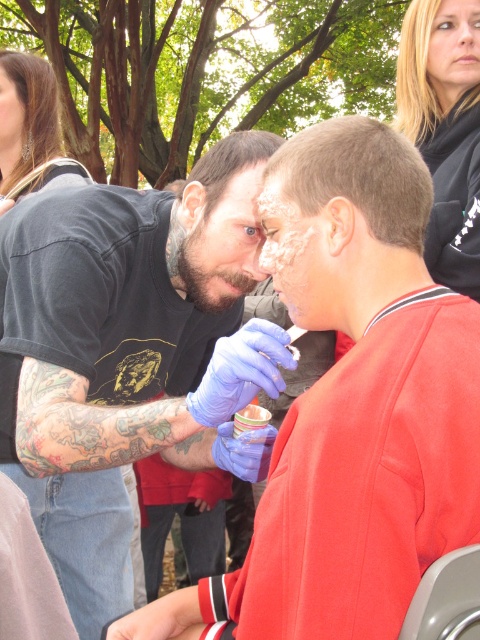
Question: Estimate the real-world distances between objects in this image. Which object is farther from the bearded man at center?

Choices:
 (A) blonde hair at upper right
 (B) white matte face paint at center

Answer: (A)

Question: Is blue latex gloves at center below white matte face paint at center?

Choices:
 (A) yes
 (B) no

Answer: (A)

Question: Which point is closer to the camera?

Choices:
 (A) pos(444,65)
 (B) pos(420,513)
 (C) pos(249,188)

Answer: (B)

Question: Is bearded man at center to the left of smooth skin face at center from the viewer's perspective?

Choices:
 (A) no
 (B) yes

Answer: (A)

Question: Does blonde hair at upper right appear over smooth skin face at upper right?

Choices:
 (A) yes
 (B) no

Answer: (B)

Question: Which point is farther from the camera taking this photo?

Choices:
 (A) (136, 612)
 (B) (16, 93)
 (C) (276, 248)

Answer: (B)